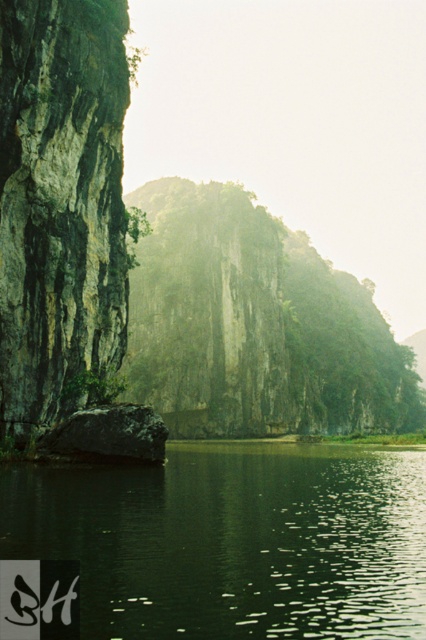
Which is more to the right, green rough rock at center or green rough rock at left?

green rough rock at center is more to the right.

What do you see at coordinates (255, 324) in the screenshot? Image resolution: width=426 pixels, height=640 pixels. I see `green rough rock at center` at bounding box center [255, 324].

Find the location of a particular element. green rough rock at center is located at coordinates (255, 324).

This screenshot has width=426, height=640. Identify the location of green smooth water at center. (233, 541).

Describe the element at coordinates (233, 541) in the screenshot. I see `green smooth water at center` at that location.

Between point (319, 620) and point (199, 294), which one is positioned in front?

Point (319, 620)

Locate an element on the screen. The width and height of the screenshot is (426, 640). green smooth water at center is located at coordinates (233, 541).

Is point (189, 557) closer to camera compared to point (9, 147)?

Yes, point (189, 557) is in front of point (9, 147).

The height and width of the screenshot is (640, 426). I want to click on green smooth water at center, so click(x=233, y=541).